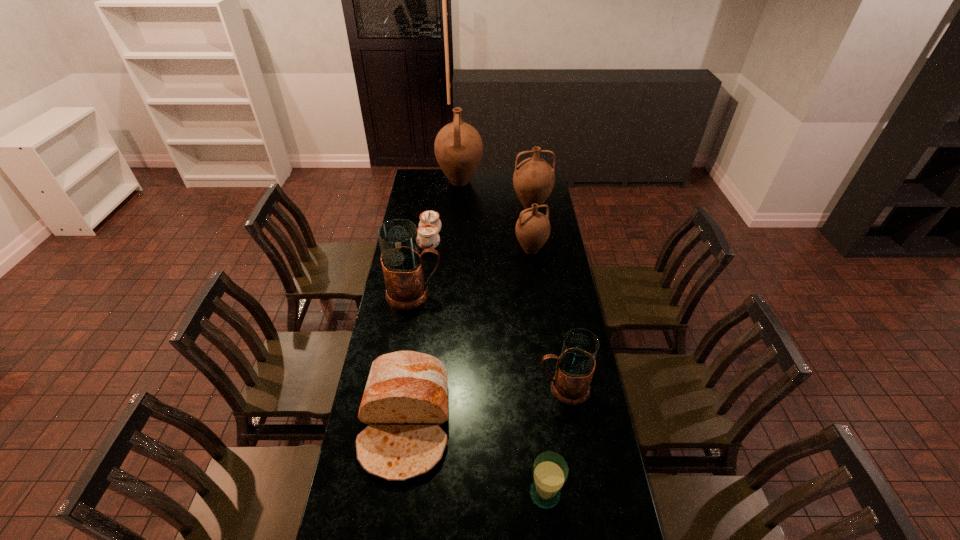
You are a GUI agent. You are given a task and a screenshot of the screen. Output one action in this format:
    pyautogui.click(x=<x>, y=<y>)
    Task: Click on the bread
    The height and width of the screenshot is (540, 960).
    Given the screenshot: What is the action you would take?
    pyautogui.click(x=405, y=400)

Identify the location of chinaware. (430, 225).

Identify the location of glass. (550, 471).

Find the location of a particular element. This screenshot has height=540, width=960. free location located on the right of the farthest pitcher is located at coordinates (516, 181).

At what (x,y) coordinates should I click in order to perform the action: click on free region located on the left of the second biggest brown pitcher. Please return your answer as a coordinate pair (x, y). Image resolution: width=960 pixels, height=540 pixels. Looking at the image, I should click on (485, 207).

Locate an element on the screen. vacant area situated with the handle on the side of the bigger gray pitcher is located at coordinates (475, 294).

The image size is (960, 540). I want to click on vacant area situated 0.210m on the front of the nearest brown pitcher, so click(537, 292).

Locate an element on the screen. The width and height of the screenshot is (960, 540). blank space located 0.050m with the handle on the side of the right gray pitcher is located at coordinates (524, 388).

The image size is (960, 540). Identify the location of vacant space located 0.350m with the handle on the side of the right gray pitcher. (444, 388).

This screenshot has width=960, height=540. What are the coordinates of `free space located 0.290m with the handle on the side of the right gray pitcher` in the screenshot? It's located at (460, 388).